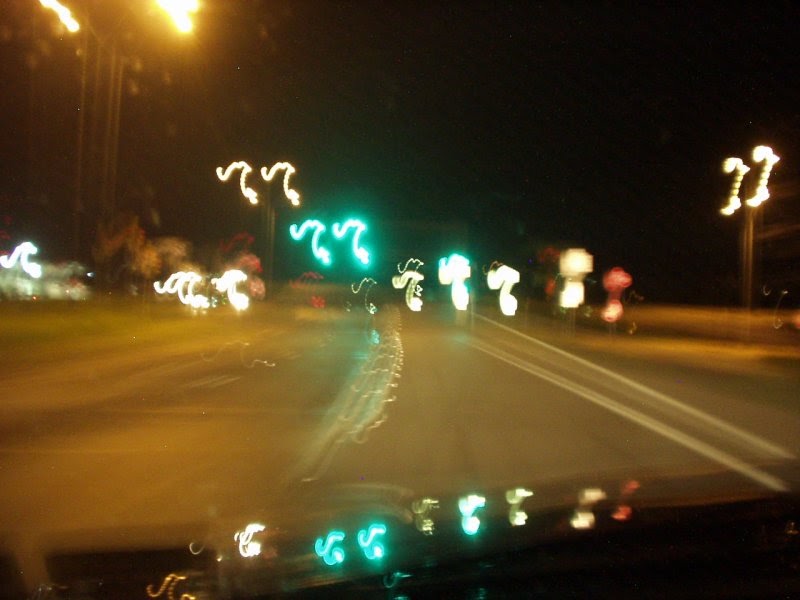
The image size is (800, 600). I want to click on sticker, so click(x=133, y=553).